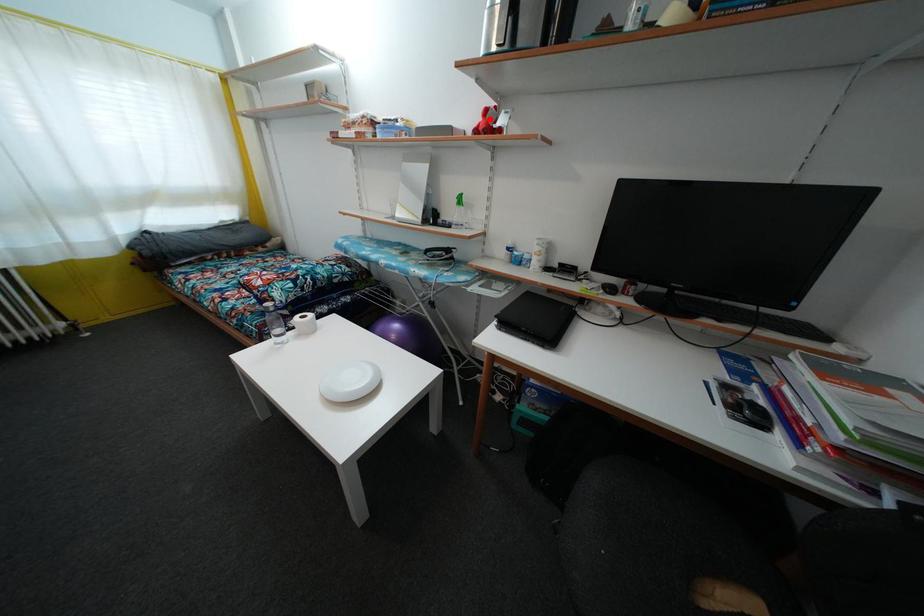
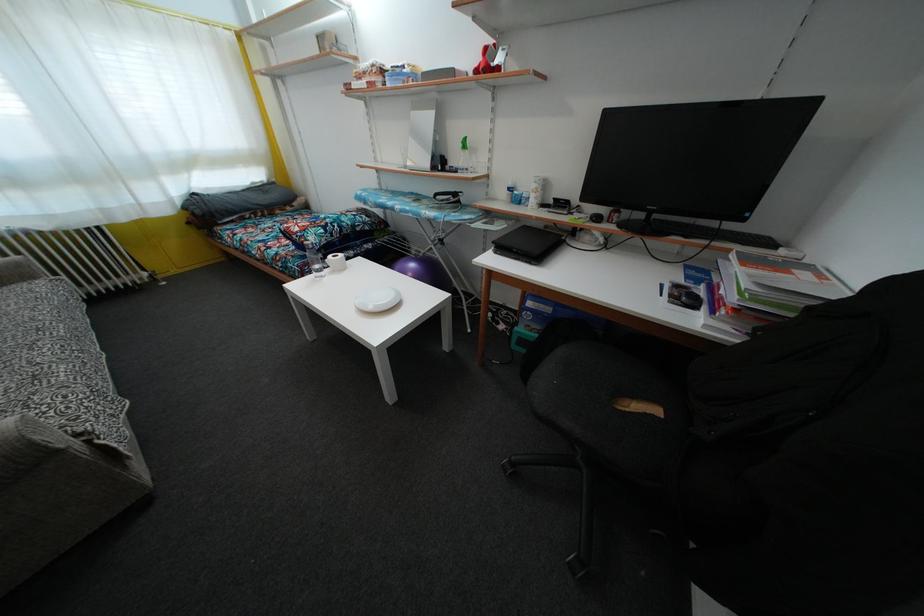
In the second image, find the point that corresponds to the highlighted location in the first image.

(490, 58)